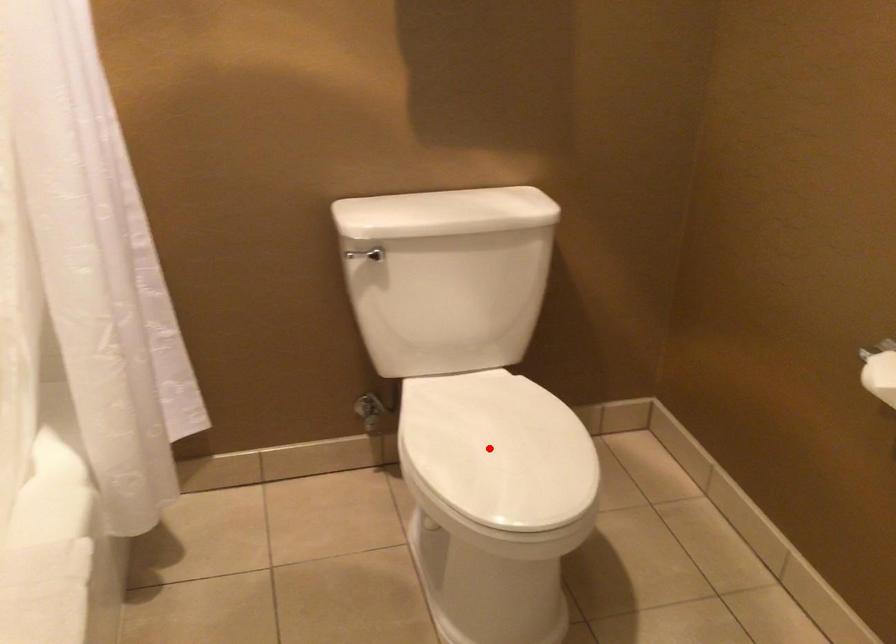
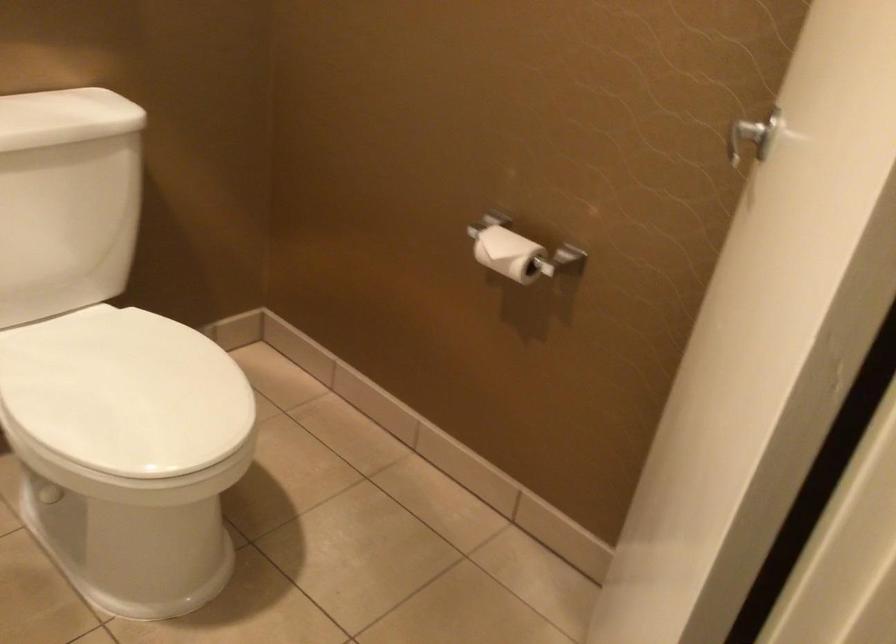
Question: I am providing you with two images of the same scene from different viewpoints. Given a red point in image1, look at the same physical point in image2. Is it:

Choices:
 (A) Closer to the viewpoint
 (B) Farther from the viewpoint

Answer: (A)